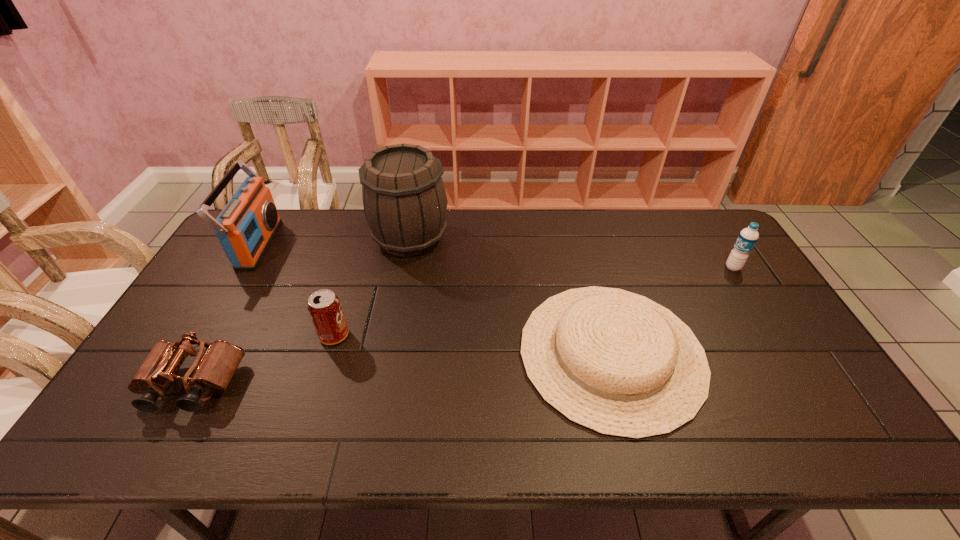
You are a GUI agent. You are given a task and a screenshot of the screen. Output one action in this format:
    pyautogui.click(x=<x>, y=<y>)
    Task: Click on the free space located on the label of the rightmost object
    
    Given the screenshot: What is the action you would take?
    pyautogui.click(x=605, y=267)

Locate an element on the screen. The height and width of the screenshot is (540, 960). vacant area situated on the label of the rightmost object is located at coordinates (691, 267).

Locate an element on the screen. This screenshot has height=540, width=960. vacant space located 0.330m on the label of the rightmost object is located at coordinates point(623,267).

The image size is (960, 540). I want to click on free space located on the front of the third shortest object, so click(313, 403).

Locate an element on the screen. Image resolution: width=960 pixels, height=540 pixels. vacant region located 0.080m through the eyepieces of the binoculars is located at coordinates [157, 449].

Image resolution: width=960 pixels, height=540 pixels. I want to click on vacant space located on the back of the second object from right to left, so pyautogui.click(x=575, y=217).

The height and width of the screenshot is (540, 960). I want to click on wine bucket located at the far edge, so click(x=404, y=199).

The height and width of the screenshot is (540, 960). In order to click on radio receiver that is at the far edge in this screenshot , I will do (x=246, y=226).

This screenshot has width=960, height=540. What are the coordinates of `binoculars that is at the near edge` in the screenshot? It's located at (213, 371).

This screenshot has width=960, height=540. I want to click on sunhat present at the near edge, so (x=618, y=363).